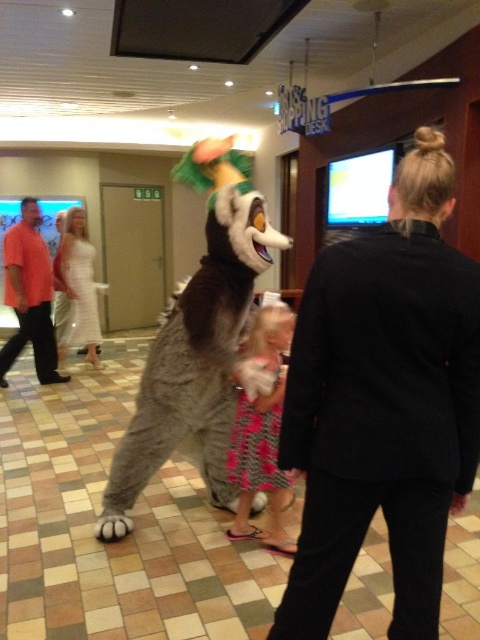
In the image, there is a point at coordinates (197,340). What object is located at this point?

The point at coordinates (197,340) corresponds to the fuzzy gray costume at center.

You are a photographer at the event and need to capture a photo where both the pink textured dress at center and the white satin dress at center are visible. Which dress should you focus on to ensure the other is in the background?

The pink textured dress at center is shorter than the white satin dress at center, so focusing on the white satin dress at center would allow the pink textured dress at center to be in the background.

You are a photographer at the event and want to capture a photo where both the fuzzy gray costume at center and the white satin dress at center are clearly visible. Based on their positions, which object is closer to the camera?

The fuzzy gray costume at center is positioned under the white satin dress at center, meaning it is closer to the camera.